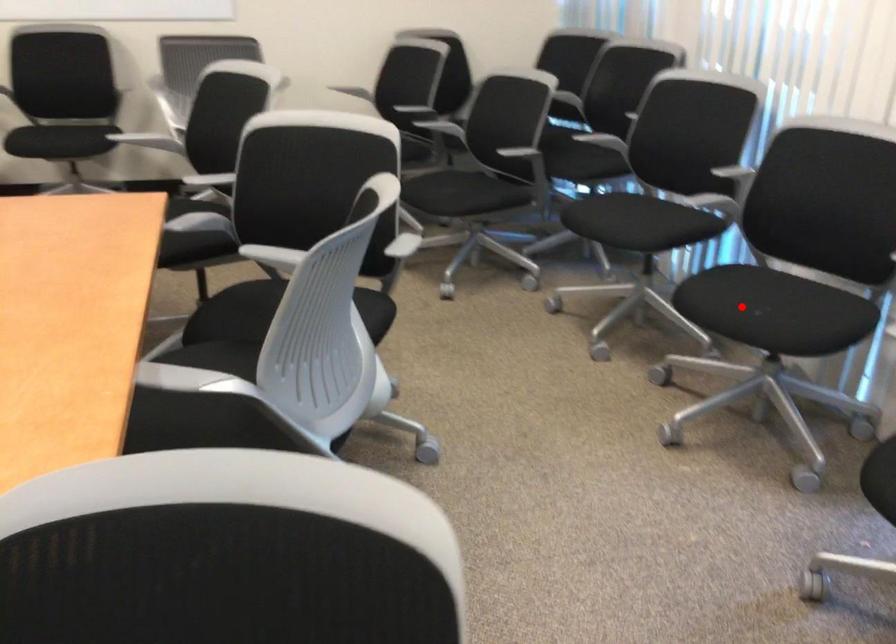
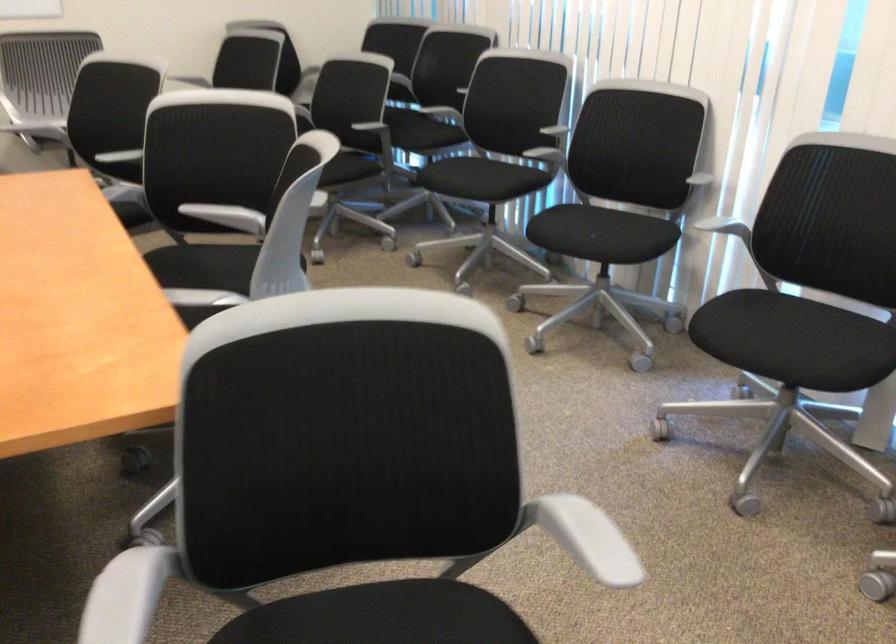
Question: A red point is marked in image1. In image2, is the corresponding 3D point closer to the camera or farther? Reply with the corresponding letter.

Choices:
 (A) The corresponding 3D point is closer.
 (B) The corresponding 3D point is farther.

Answer: (B)